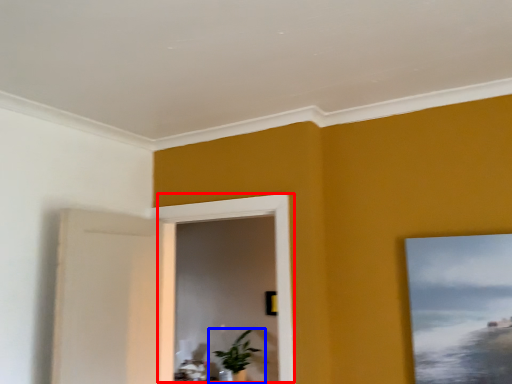
Question: Which of the following is the closest to the observer, window (highlighted by a red box) or houseplant (highlighted by a blue box)?

Choices:
 (A) window
 (B) houseplant

Answer: (A)